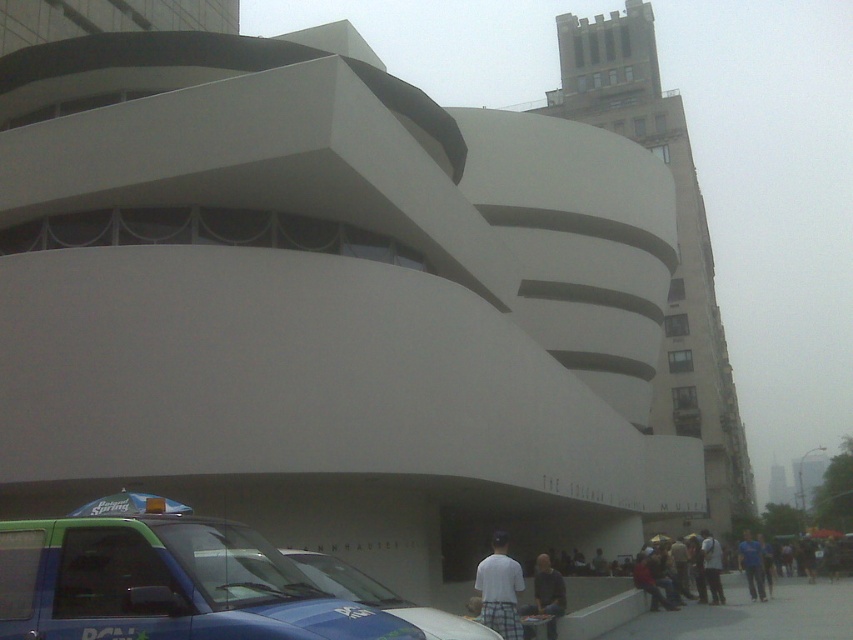
Question: Which object appears closest to the camera in this image?

Choices:
 (A) blue glossy van at lower left
 (B) white plaid shorts at lower center
 (C) blue fabric shirt at lower right

Answer: (A)

Question: Can you confirm if white plaid shorts at lower center is bigger than dark gray shirt at lower center?

Choices:
 (A) yes
 (B) no

Answer: (B)

Question: Is blue glossy car at lower left further to camera compared to white cotton shirt at center?

Choices:
 (A) yes
 (B) no

Answer: (B)

Question: Which of the following is the closest to the observer?

Choices:
 (A) white smooth building at center
 (B) blue glossy car at lower left
 (C) blue glossy van at lower left
 (D) blue fabric shirt at lower right

Answer: (C)

Question: Which object appears closest to the camera in this image?

Choices:
 (A) dark gray shirt at lower center
 (B) white smooth building at center

Answer: (A)

Question: Is blue glossy van at lower left to the right of white plaid shorts at lower center from the viewer's perspective?

Choices:
 (A) no
 (B) yes

Answer: (A)